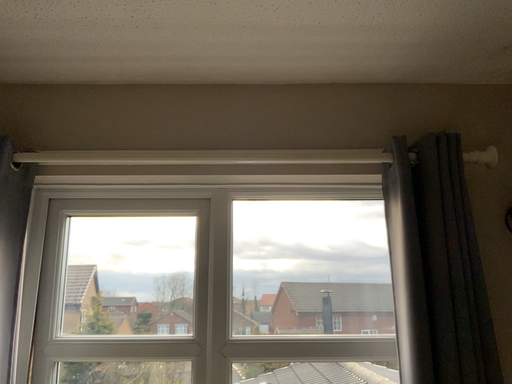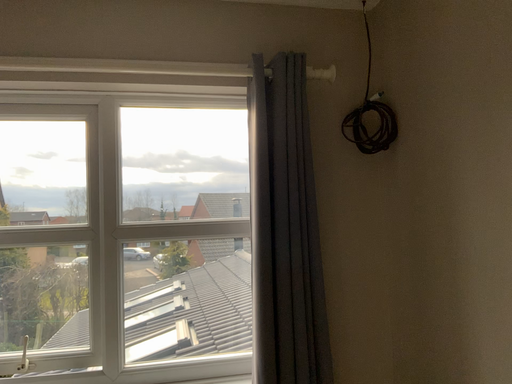
Question: Which way did the camera rotate in the video?

Choices:
 (A) rotated upward
 (B) rotated downward

Answer: (B)